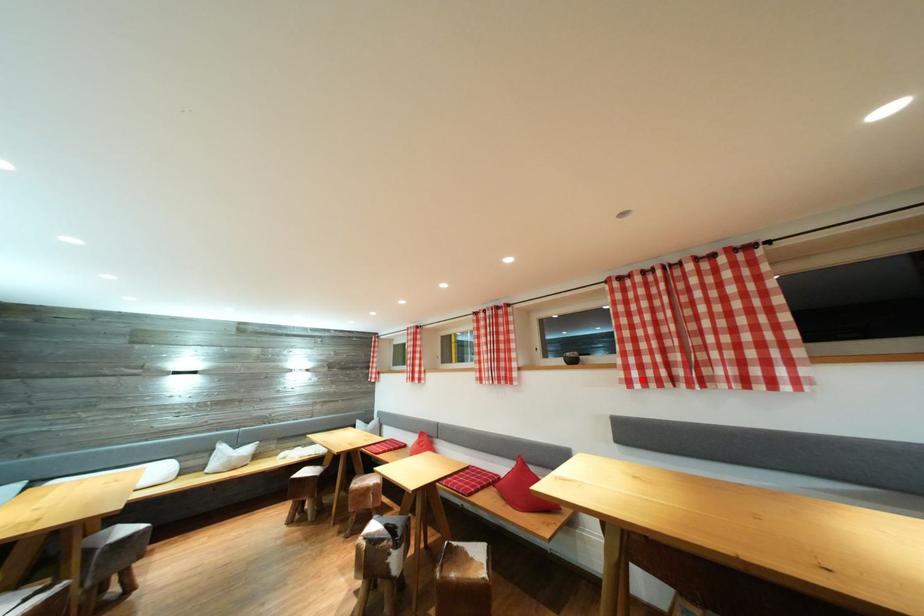
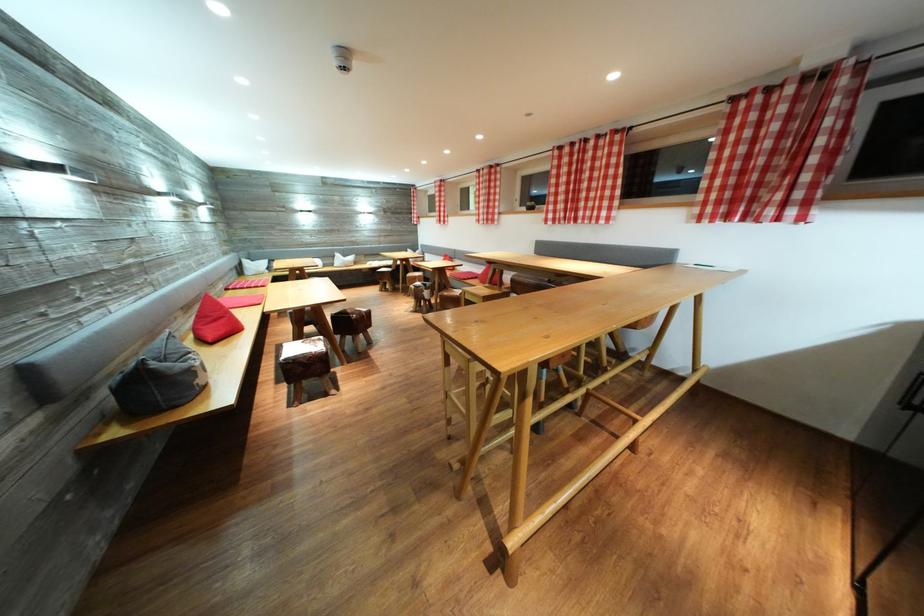
Where in the second image is the point corresponding to the highlighted location from the first image?

(556, 222)